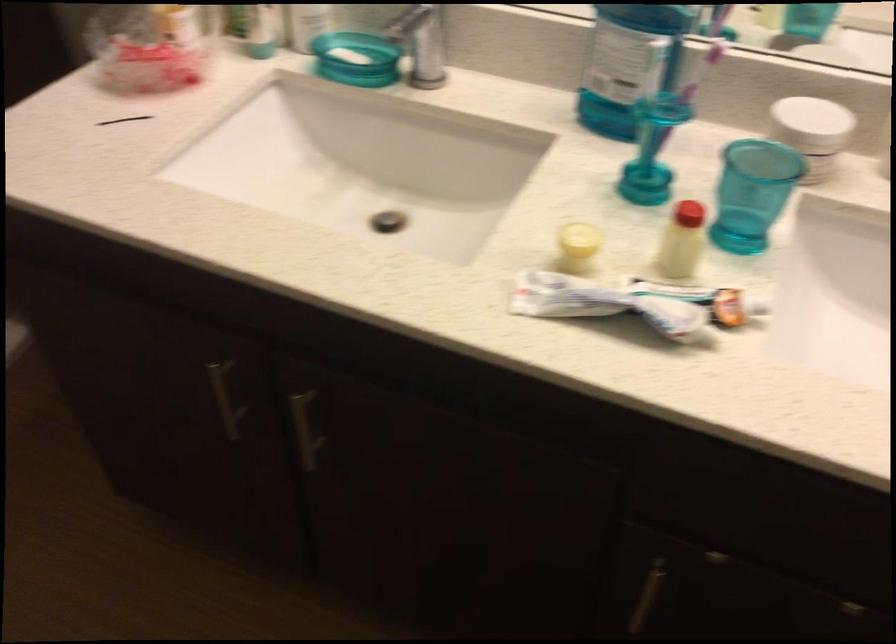
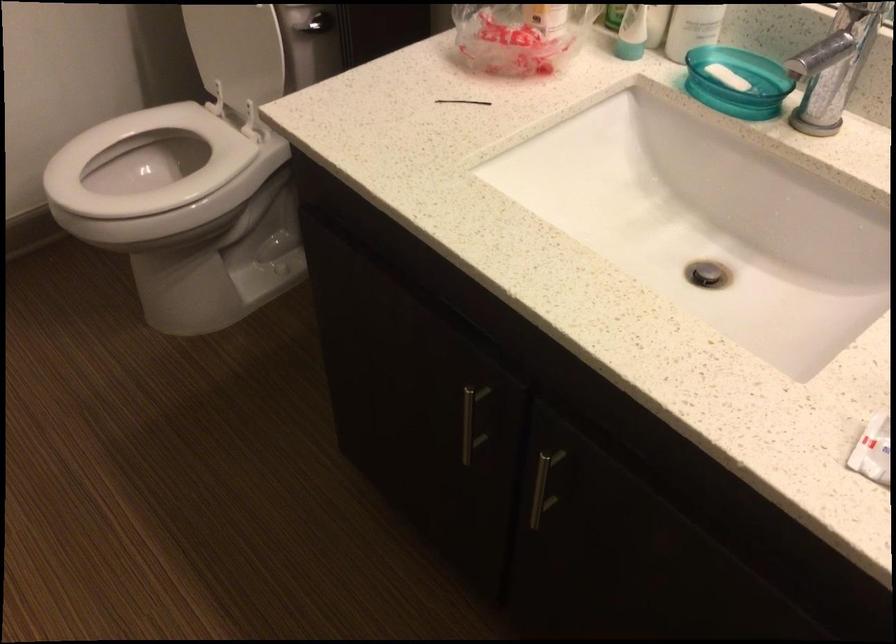
What movement of the cameraman would produce the second image?

The cameraman walked toward left, forward.